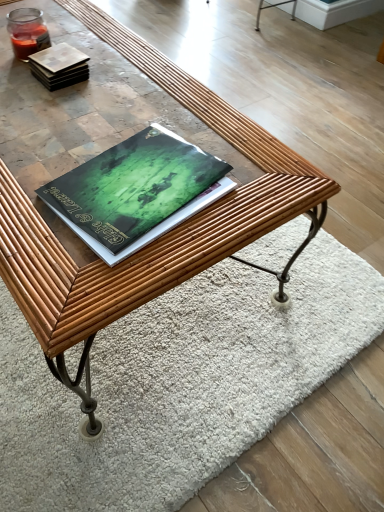
Locate an element on the screen. Image resolution: width=384 pixels, height=512 pixels. vacant space to the right of green matte book at center, the 2th book viewed from the top is located at coordinates (258, 187).